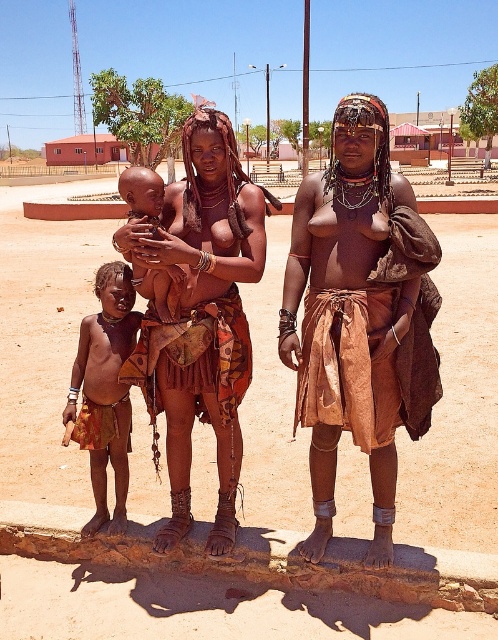
Does point (163, 449) come farther from viewer compared to point (129, 323)?

Yes, it is.

Is point (464, 436) closer to viewer compared to point (116, 492)?

No, (464, 436) is behind (116, 492).

Locate an element on the screen. dirt field at center is located at coordinates (201, 609).

This screenshot has width=498, height=640. I want to click on matte orange skirt at lower left, so 105,392.

Who is positioned more to the left, matte orange skirt at lower left or dark skin baby at center?

Positioned to the left is dark skin baby at center.

The height and width of the screenshot is (640, 498). I want to click on matte orange skirt at lower left, so click(x=105, y=392).

Where is `matte orange skirt at lower left`? This screenshot has width=498, height=640. matte orange skirt at lower left is located at coordinates (105, 392).

Is point (384, 541) in front of point (131, 355)?

Yes, it is in front of point (131, 355).

Locate an element on the screen. The width and height of the screenshot is (498, 640). brown leather skirt at center is located at coordinates (359, 316).

Locate an element on the screen. The image size is (498, 640). brown leather skirt at center is located at coordinates (359, 316).